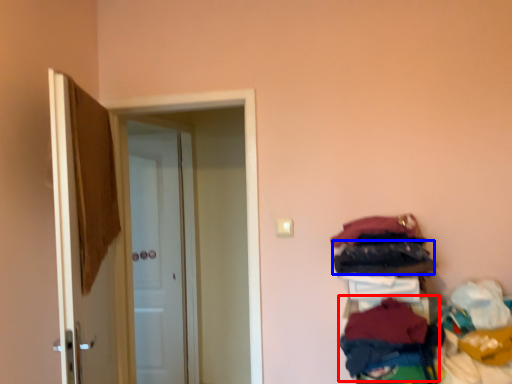
Question: Among these objects, which one is nearest to the camera, clothing (highlighted by a red box) or clothing (highlighted by a blue box)?

Choices:
 (A) clothing
 (B) clothing

Answer: (A)